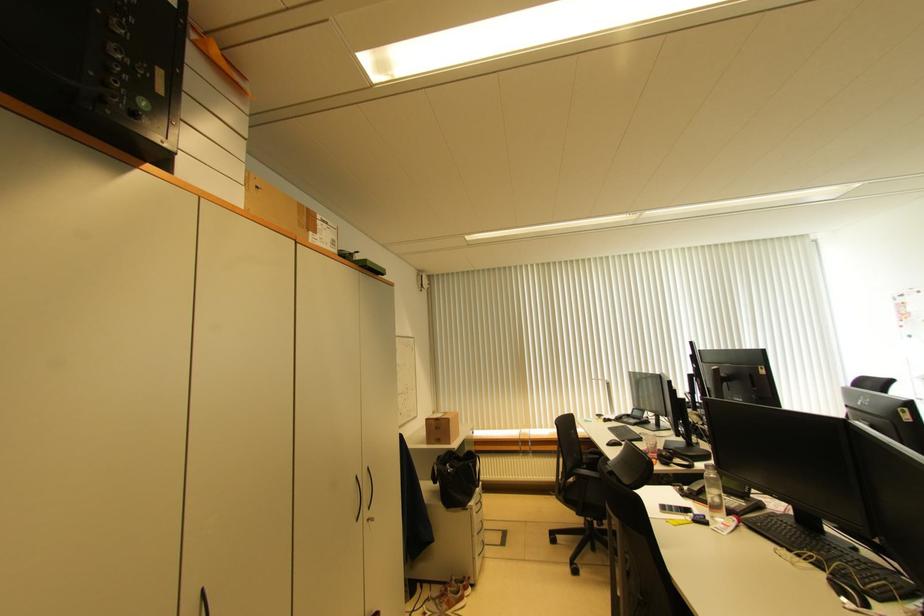
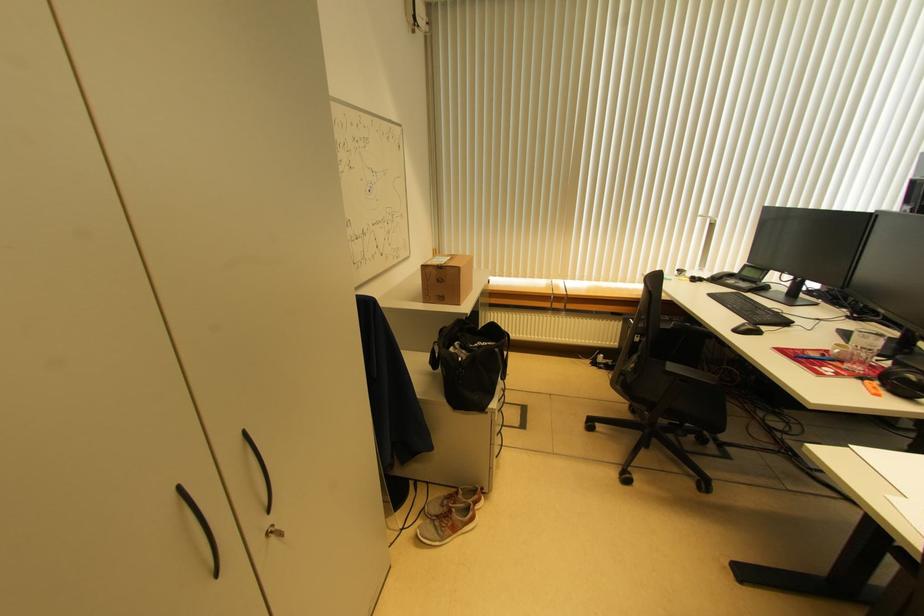
In the second image, find the point that corresponds to point 372,521 in the first image.

(280, 530)